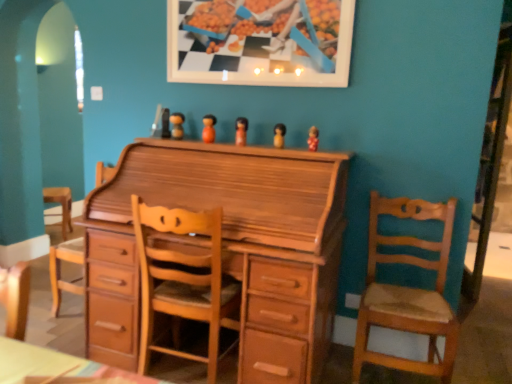
The image size is (512, 384). What are the coordinates of `vacant region to the left of wooden figurine at center, marked as the 3th toy in a right-to-left arrangement` in the screenshot? It's located at (209, 144).